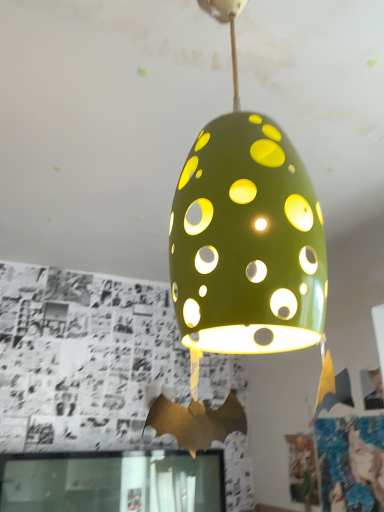
You are a GUI agent. You are given a task and a screenshot of the screen. Output one action in this format:
    pyautogui.click(x=<x>, y=<y>)
    Task: Click on the green matte lampshade at center
    This screenshot has height=512, width=384.
    Given the screenshot: What is the action you would take?
    pyautogui.click(x=240, y=255)

Describe the element at coordinates (240, 255) in the screenshot. I see `green matte lampshade at center` at that location.

Identify the location of green matte lampshade at center. This screenshot has width=384, height=512. (240, 255).